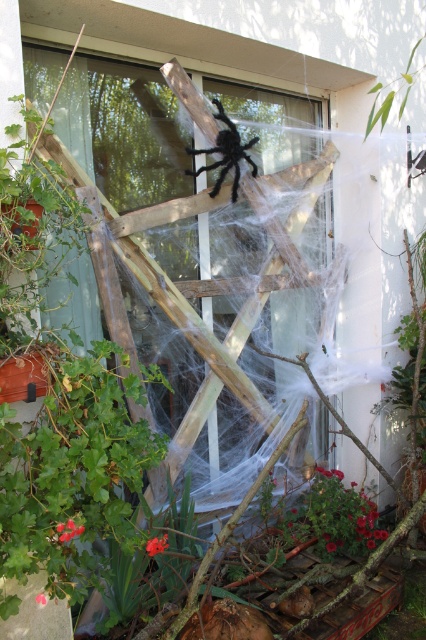
You are a gardener who needs to water the green matte plant at lower right. You are currently standing next to the black fuzzy spider at upper center. Can you reach the plant without moving your position? Please explain your reasoning.

The green matte plant at lower right and the black fuzzy spider at upper center are 1.67 meters apart. Since the distance between them is 1.67 meters, unless the gardener has an unusually long watering tool, they would likely need to move closer to water the plant effectively.

You are a gardener who wants to place a new decorative item in the scene. The item is 12 inches wide. You have two options to place it next to either the green matte plant at lower right or the black fuzzy spider at upper center. Which location would allow the item to fit without overlapping?

The green matte plant at lower right has a larger width than the black fuzzy spider at upper center. Since the item is 12 inches wide, placing it next to the green matte plant at lower right would provide more space and prevent overlapping.